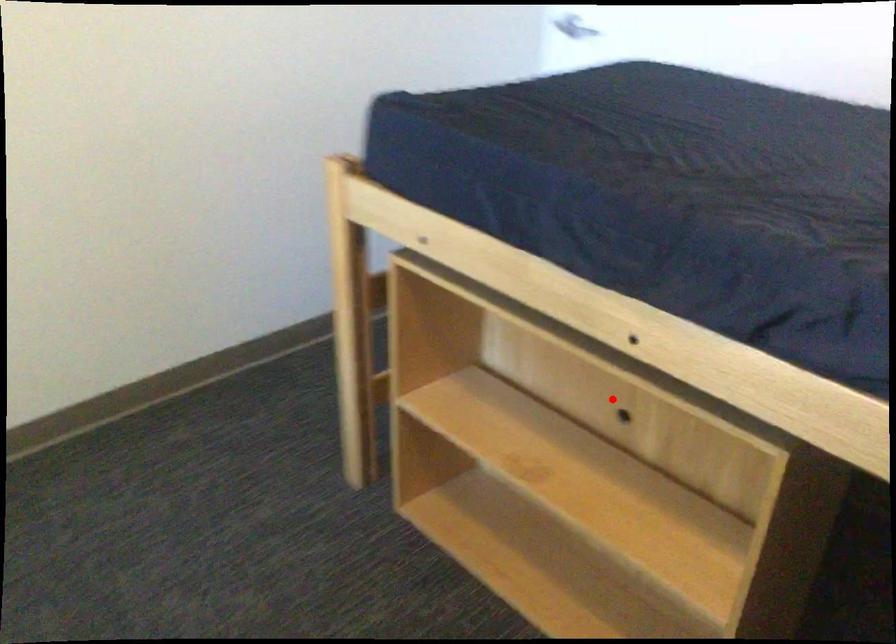
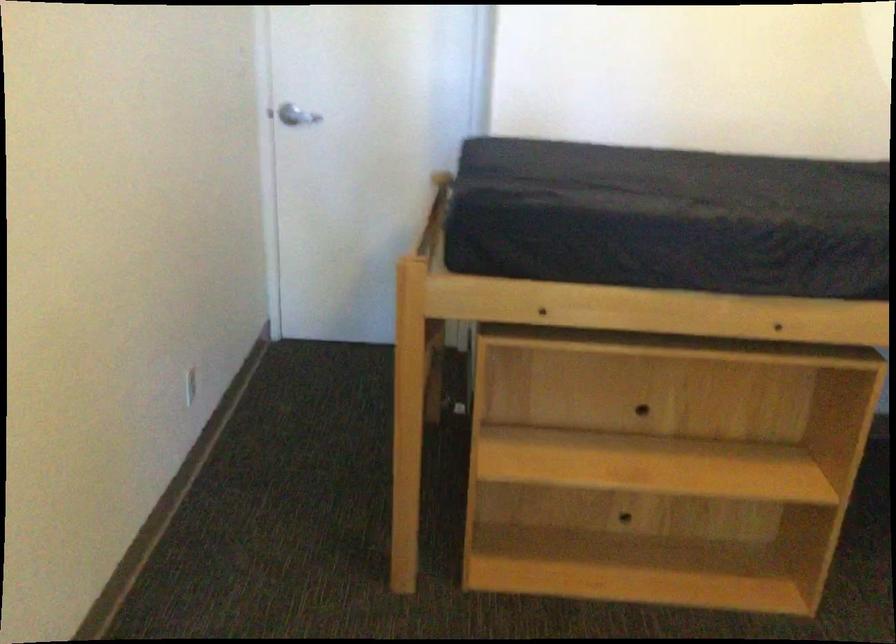
Find the pixel in the second image that matches the highlighted location in the first image.

(633, 395)